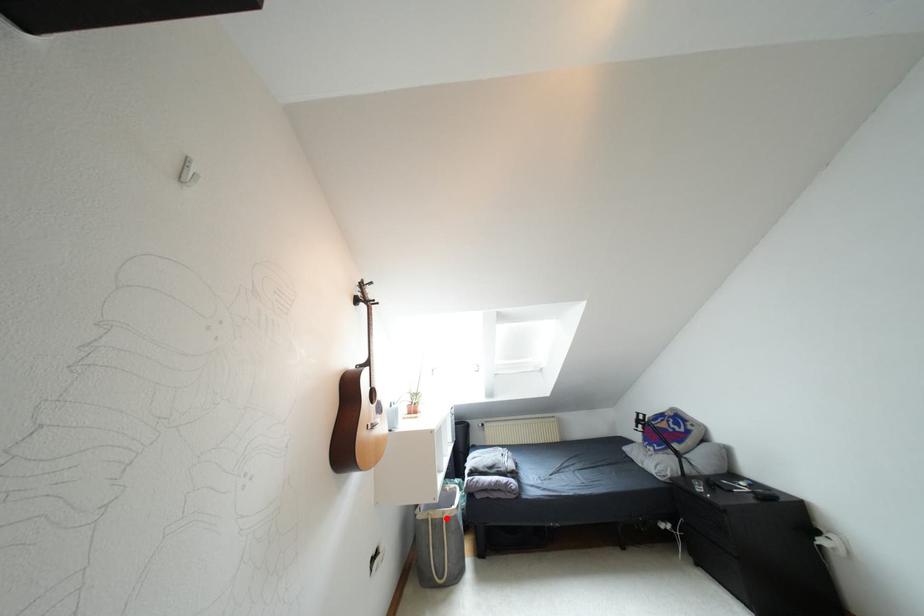
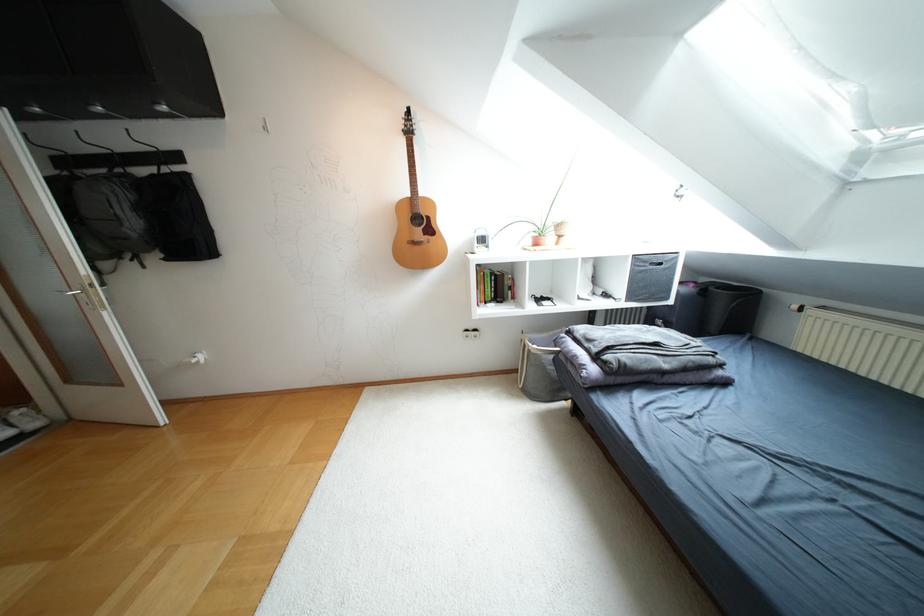
Where in the second image is the point corresponding to the highlighted location from the first image?

(528, 350)